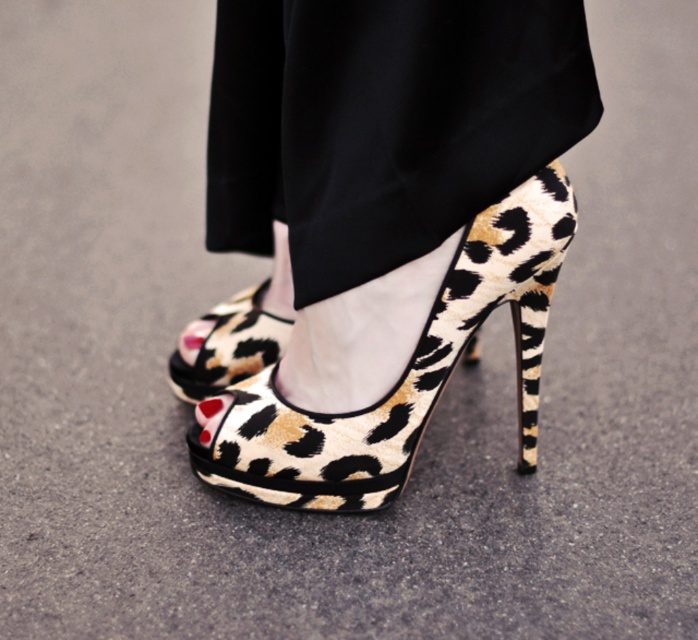
Does leopard print suede sandal at center have a lesser height compared to leopard print fabric high-heeled shoe at center?

No.

Is leopard print suede sandal at center bigger than leopard print fabric high-heeled shoe at center?

Correct, leopard print suede sandal at center is larger in size than leopard print fabric high-heeled shoe at center.

Who is more forward, (x=339, y=451) or (x=262, y=349)?

Positioned in front is point (x=339, y=451).

Locate an element on the screen. leopard print suede sandal at center is located at coordinates (400, 376).